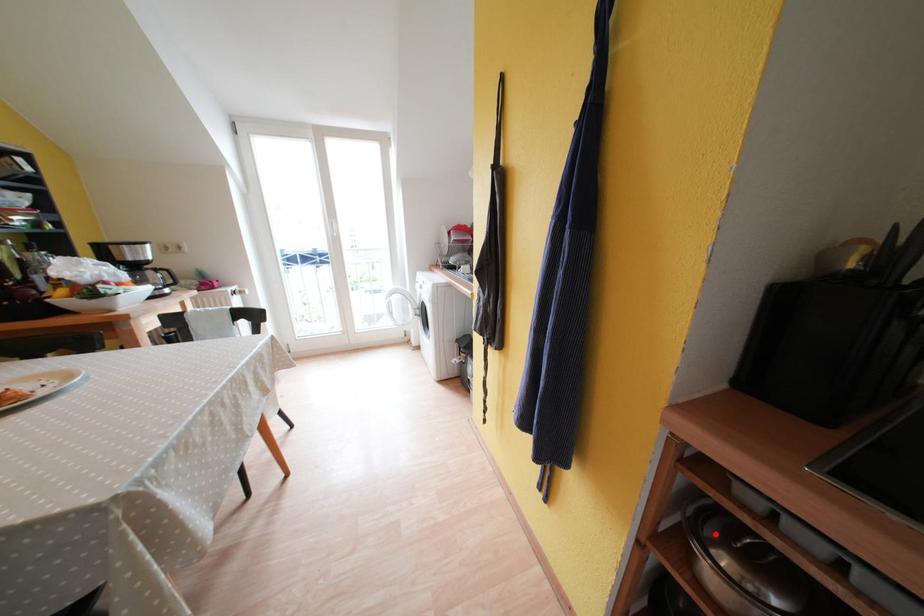
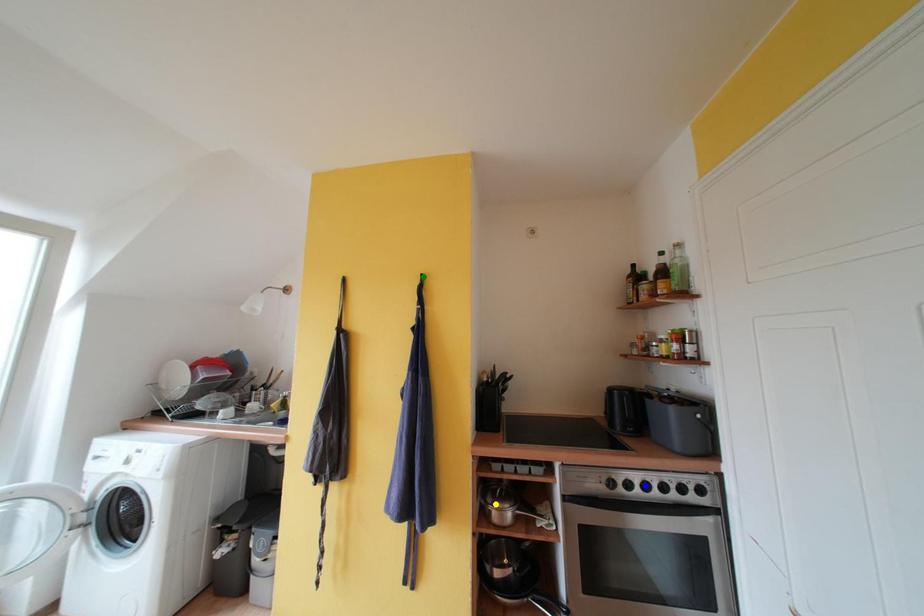
Question: I am providing you with two images of the same scene from different viewpoints. A red point is marked on the first image. You are given multiple points on the second image. Which point in image 2 represents the same 3d spot as the red point in image 1?

Choices:
 (A) blue point
 (B) yellow point
 (C) green point

Answer: (B)